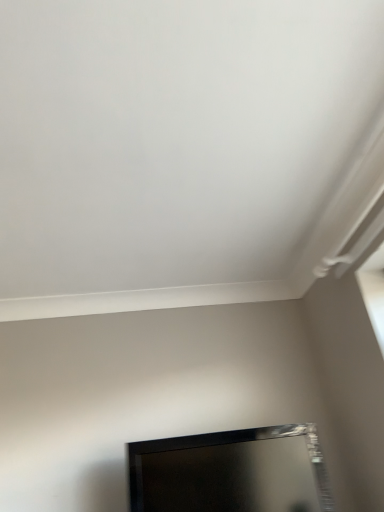
This screenshot has width=384, height=512. In order to click on black glossy tv at lower center in this screenshot , I will do `click(231, 472)`.

What do you see at coordinates (231, 472) in the screenshot?
I see `black glossy tv at lower center` at bounding box center [231, 472].

Find the location of a particular element. The width and height of the screenshot is (384, 512). black glossy tv at lower center is located at coordinates (231, 472).